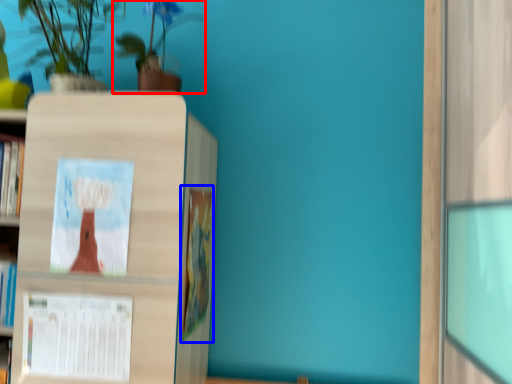
Question: Which of the following is the farthest to the observer, houseplant (highlighted by a red box) or book (highlighted by a blue box)?

Choices:
 (A) houseplant
 (B) book

Answer: (B)